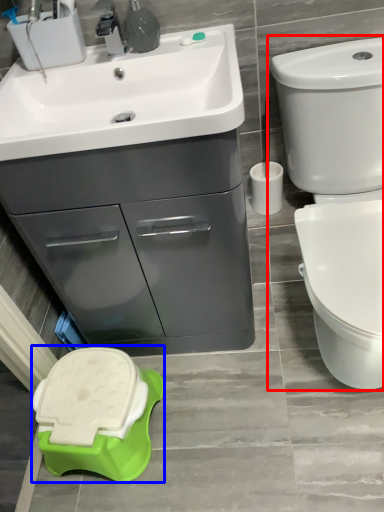
Question: Which point is further to the camera, toilet (highlighted by a red box) or porcelain (highlighted by a blue box)?

Choices:
 (A) toilet
 (B) porcelain

Answer: (B)